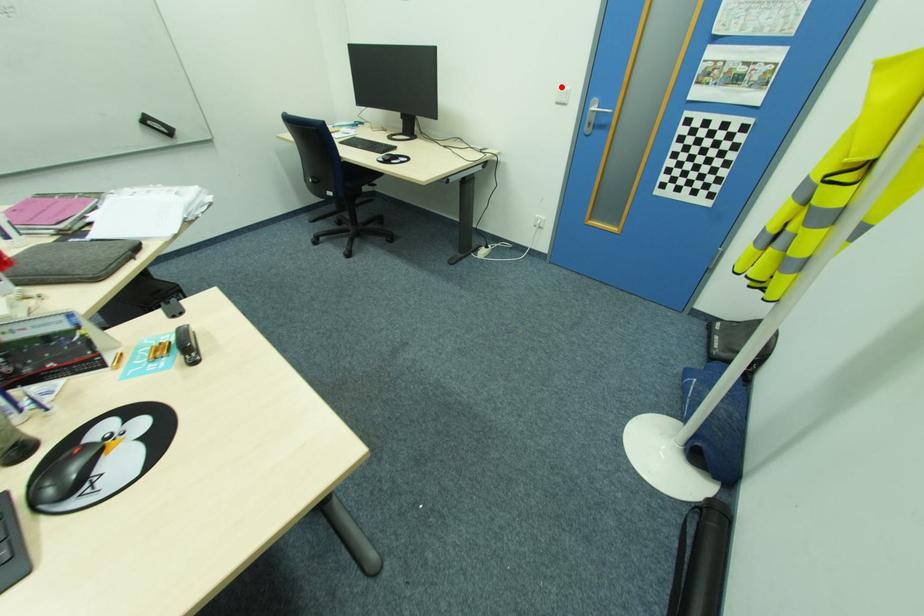
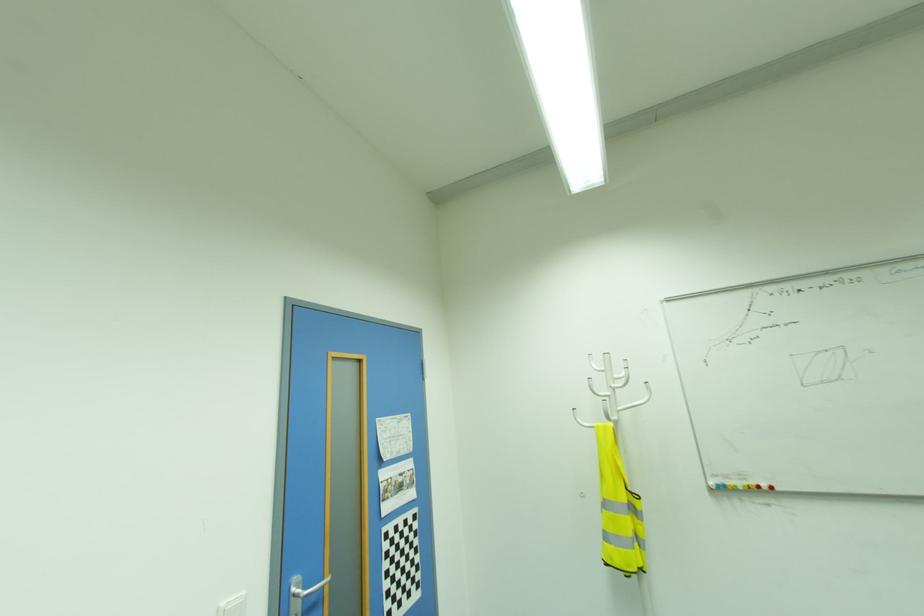
The point at the highlighted location is marked in the first image. Where is the corresponding point in the second image?

(226, 602)